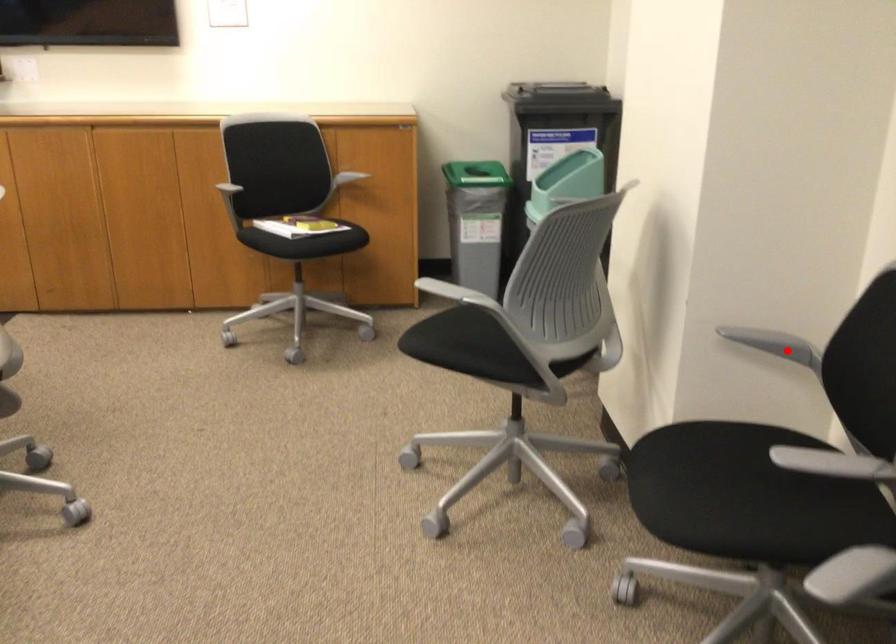
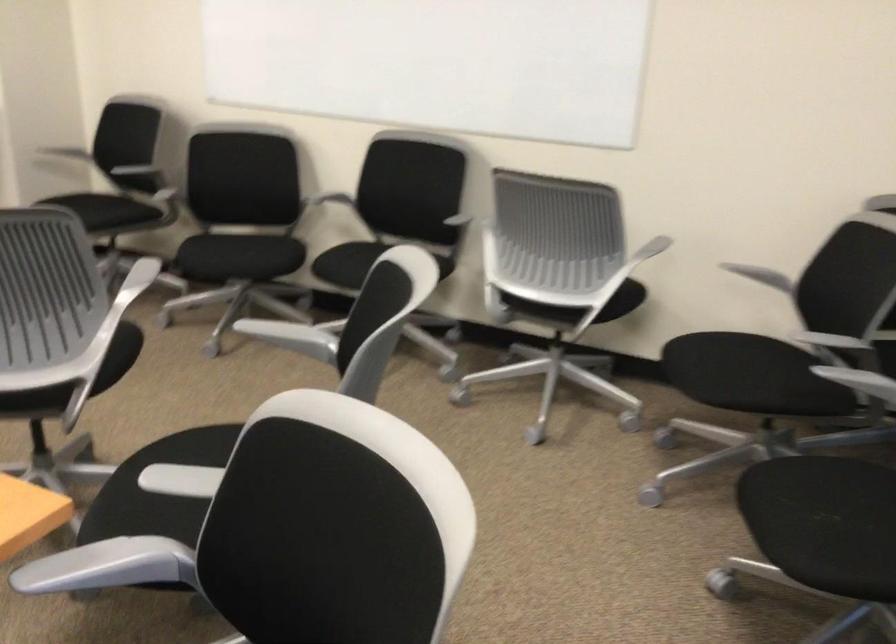
Question: I am providing you with two images of the same scene from different viewpoints. Given a red point in image1, look at the same physical point in image2. Is it:

Choices:
 (A) Closer to the viewpoint
 (B) Farther from the viewpoint

Answer: (B)